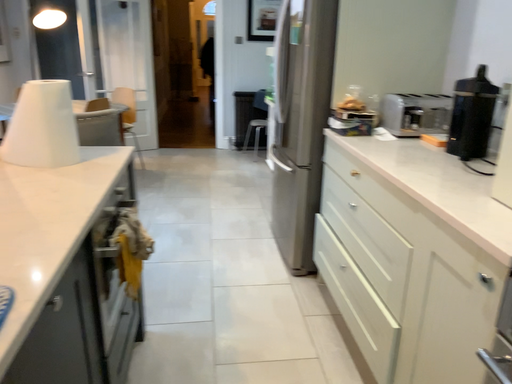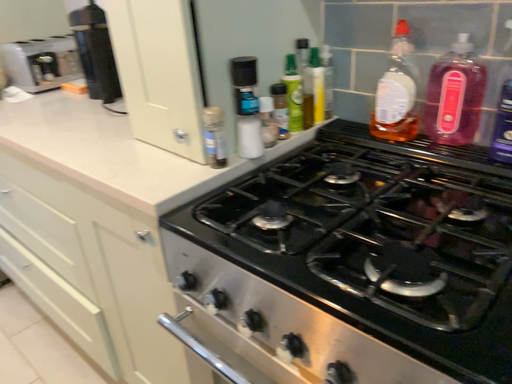
Question: Which way did the camera rotate in the video?

Choices:
 (A) rotated left
 (B) rotated right

Answer: (B)